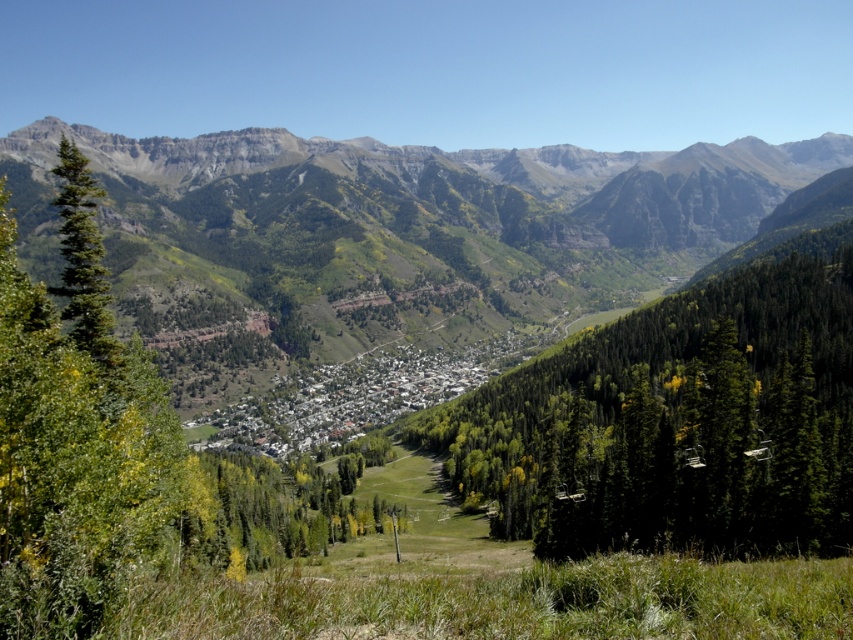
What is the exact location of the green forested mountain range at center in the image?

The green forested mountain range at center is located at point (386,236).

Based on the given scene, where is the green forested mountain range at center located in terms of 2D coordinates?

The green forested mountain range at center is located at the 2D coordinates of point (386,236).

You are standing at the origin point of the image. You want to walk towards the green textured tree at center. Which direction should you move in?

The green textured tree at center is located at point 0.664 on the x axis and 0.790 on the y axis, so you should move towards the upper right direction to reach it.